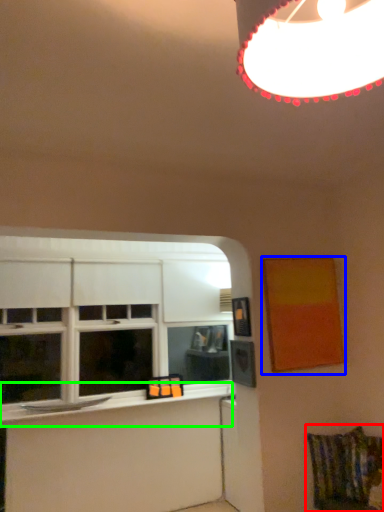
Question: Which object is positioned closest to swivel chair (highlighted by a red box)? Select from picture frame (highlighted by a blue box) and window sill (highlighted by a green box).

Choices:
 (A) picture frame
 (B) window sill

Answer: (A)